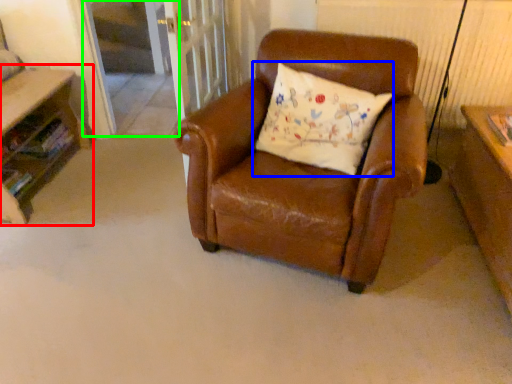
Question: Which object is the closest to the table (highlighted by a red box)? Choose among these: pillow (highlighted by a blue box) or screen door (highlighted by a green box).

Choices:
 (A) pillow
 (B) screen door

Answer: (B)